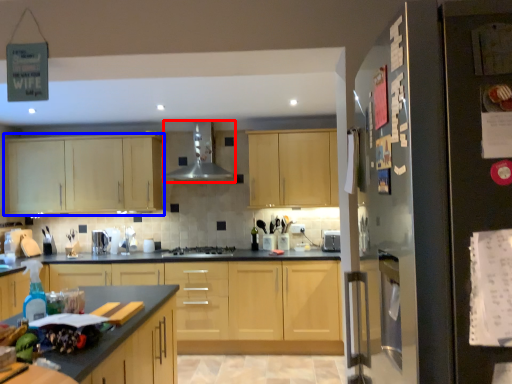
Question: Which object appears closest to the camera in this image, exhaust hood (highlighted by a red box) or cabinetry (highlighted by a blue box)?

Choices:
 (A) exhaust hood
 (B) cabinetry

Answer: (A)